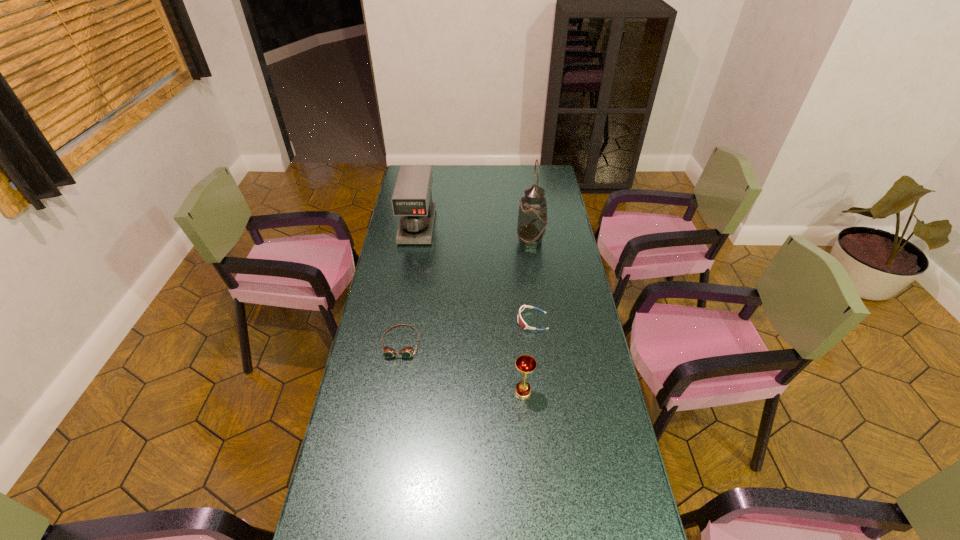
What are the coordinates of `the tallest object` in the screenshot? It's located at (532, 219).

Identify the location of the second tallest object. (412, 197).

Find the location of `the nearest object`. the nearest object is located at coordinates (526, 364).

Where is `chalice`? The width and height of the screenshot is (960, 540). chalice is located at coordinates (526, 364).

Identify the location of the right goggles. The image size is (960, 540). (521, 322).

Find the location of a particular element. The height and width of the screenshot is (540, 960). the left goggles is located at coordinates (406, 352).

You are a GUI agent. You are given a task and a screenshot of the screen. Output one action in this format:
    pyautogui.click(x=<x>, y=<y>)
    Task: Click on the vacant space located on the back of the tallest object
    This screenshot has height=540, width=960.
    Given the screenshot: What is the action you would take?
    pyautogui.click(x=528, y=222)

Where is `vacant point located 0.190m on the carafe side of the fourth shortest object`? This screenshot has width=960, height=540. vacant point located 0.190m on the carafe side of the fourth shortest object is located at coordinates (409, 274).

Find the location of a particular element. This screenshot has width=960, height=540. vacant area situated 0.200m on the front of the nearest object is located at coordinates (529, 462).

Where is `vacant region located 0.350m on the front-facing side of the right goggles`? The image size is (960, 540). vacant region located 0.350m on the front-facing side of the right goggles is located at coordinates (423, 321).